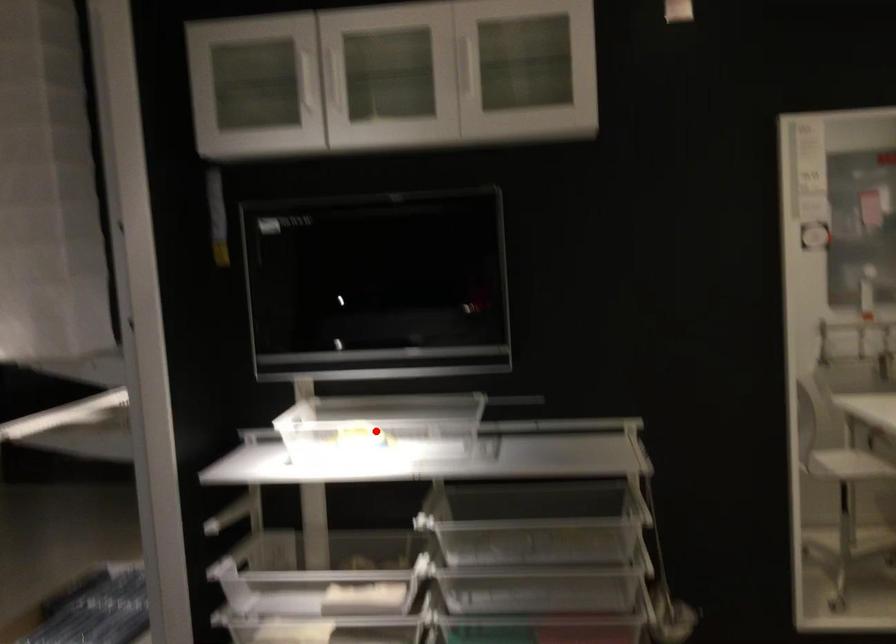
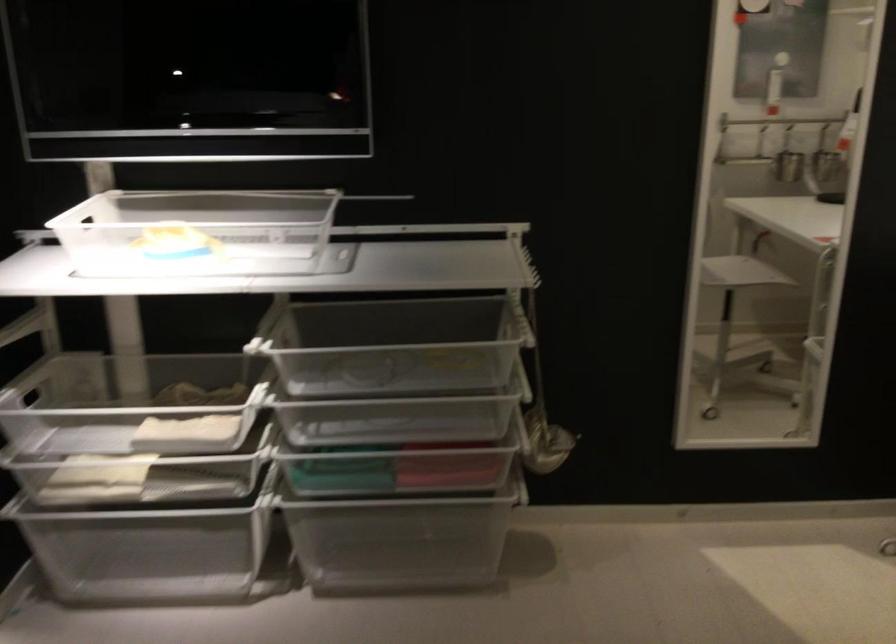
The point at the highlighted location is marked in the first image. Where is the corresponding point in the second image?

(197, 232)